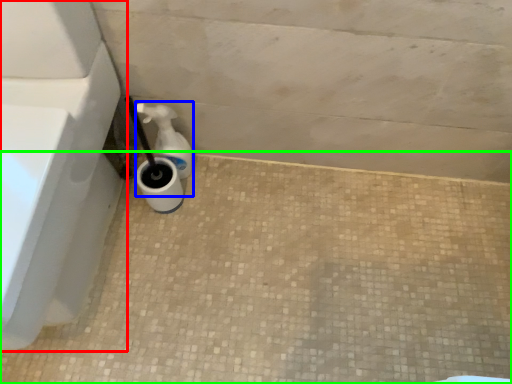
Question: Based on their relative distances, which object is farther from bath (highlighted by a red box)? Choose from soap dispenser (highlighted by a blue box) and concrete (highlighted by a green box).

Choices:
 (A) soap dispenser
 (B) concrete

Answer: (B)